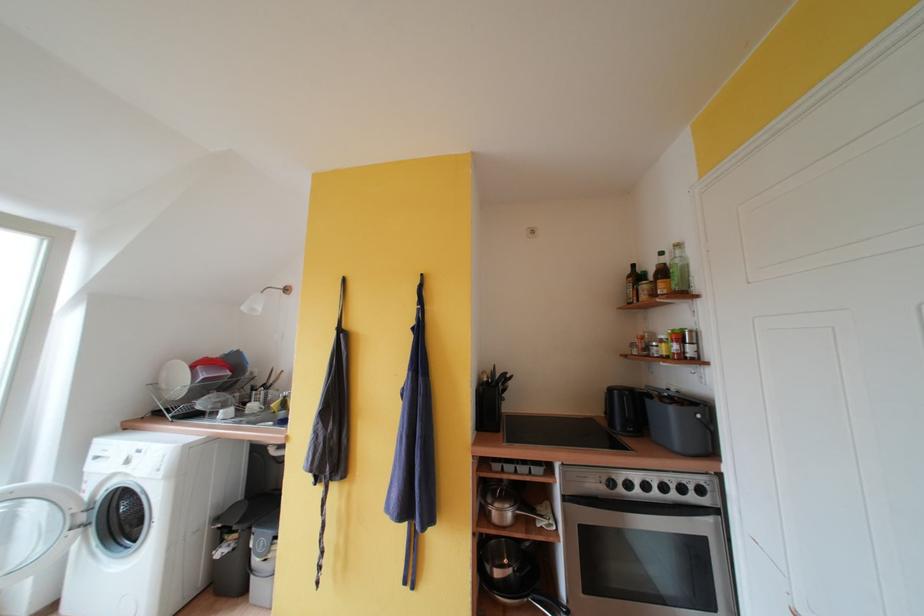
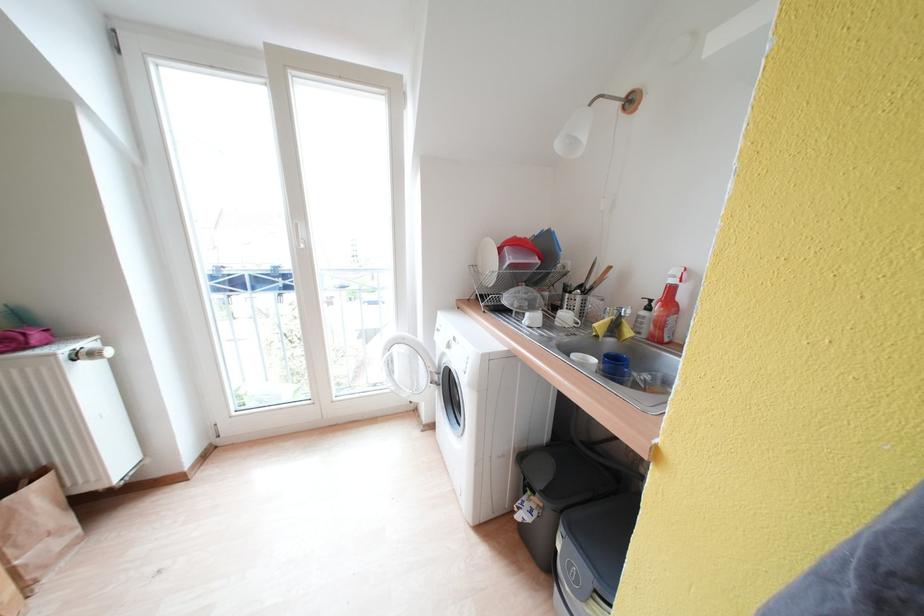
Locate, in the second image, the point that corresponds to the point at 265,389 in the first image.

(581, 289)